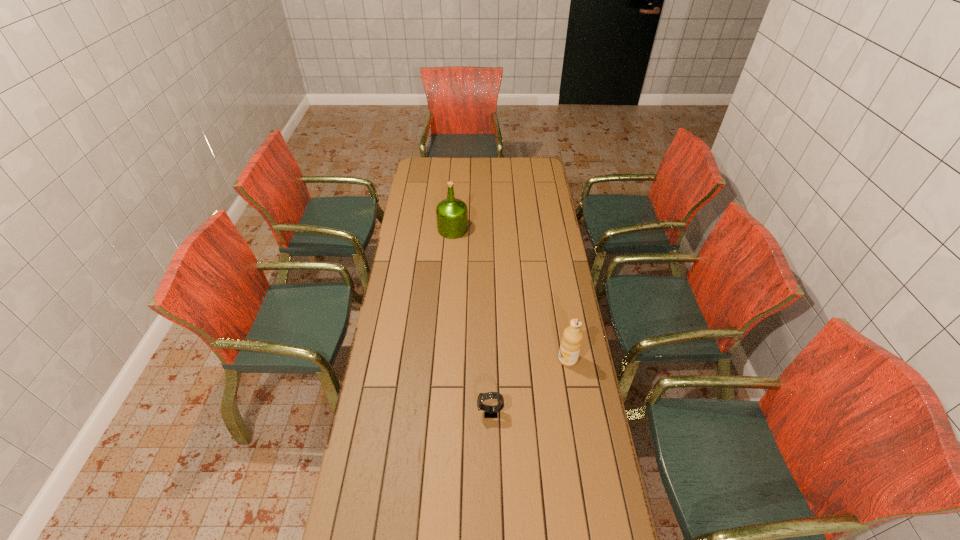
Image resolution: width=960 pixels, height=540 pixels. Find the location of `the farthest object`. the farthest object is located at coordinates (452, 214).

The image size is (960, 540). I want to click on the farther olive oil, so click(452, 214).

This screenshot has height=540, width=960. I want to click on the shorter olive oil, so click(x=571, y=342).

You are a GUI agent. You are given a task and a screenshot of the screen. Output one action in this format:
    pyautogui.click(x=<x>, y=<y>)
    Task: Click on the right olive oil
    This screenshot has height=540, width=960.
    Given the screenshot: What is the action you would take?
    pyautogui.click(x=571, y=342)

This screenshot has height=540, width=960. Find the location of `watch`. watch is located at coordinates (489, 411).

Locate an element on the screen. the second object from left to right is located at coordinates (489, 411).

The width and height of the screenshot is (960, 540). What are the coordinates of `free spot located on the back of the farthest object` in the screenshot? It's located at (455, 204).

Find the location of `free space located on the label of the second farthest object`. free space located on the label of the second farthest object is located at coordinates (520, 359).

I want to click on vacant space located 0.250m on the label of the second farthest object, so click(492, 359).

You are a GUI agent. You are given a task and a screenshot of the screen. Output one action in this format:
    pyautogui.click(x=<x>, y=<y>)
    Task: Click on the free spot located 0.270m on the label of the second farthest object
    The image size is (960, 540).
    Given the screenshot: What is the action you would take?
    pyautogui.click(x=486, y=359)